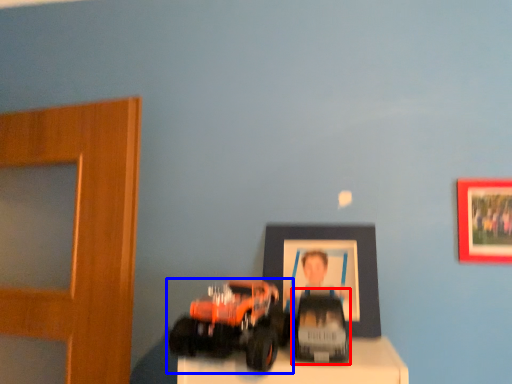
Question: Which object appears farthest to the camera in this image, toy (highlighted by a red box) or toy (highlighted by a blue box)?

Choices:
 (A) toy
 (B) toy

Answer: (A)